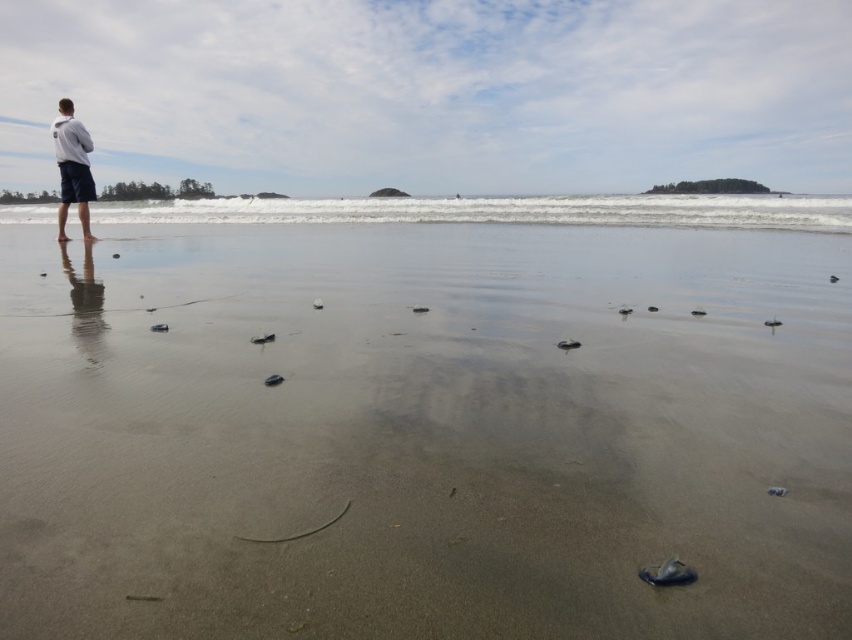
Does point (334, 400) come closer to viewer compared to point (72, 198)?

Yes, it is in front of point (72, 198).

Is smooth sand at lower center behind white matte jacket at upper left?

No, it is not.

The image size is (852, 640). What do you see at coordinates (422, 433) in the screenshot? I see `smooth sand at lower center` at bounding box center [422, 433].

Locate an element on the screen. The width and height of the screenshot is (852, 640). smooth sand at lower center is located at coordinates (422, 433).